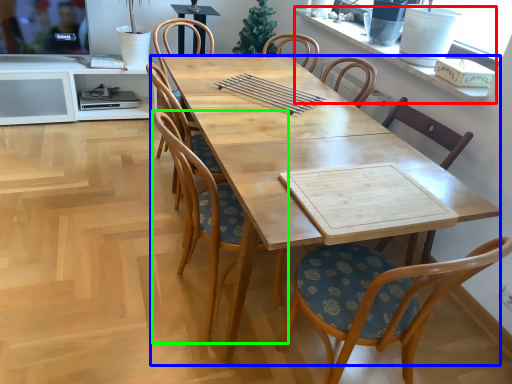
Question: Which is nearer to the window sill (highlighted by a red box)? desk (highlighted by a blue box) or chair (highlighted by a green box).

Choices:
 (A) desk
 (B) chair

Answer: (A)